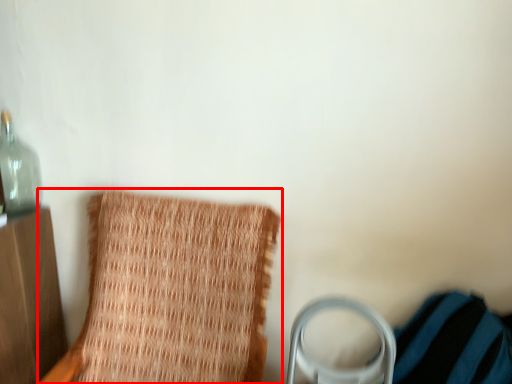
Question: From the image's perspective, what is the correct spatial relationship of furniture (annotated by the red box) in relation to bottle?

Choices:
 (A) above
 (B) below

Answer: (B)